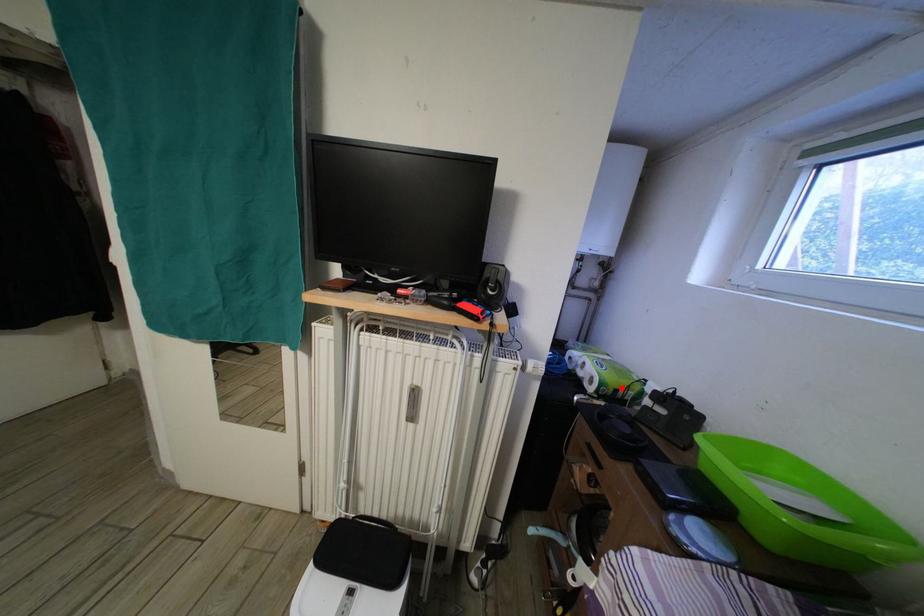
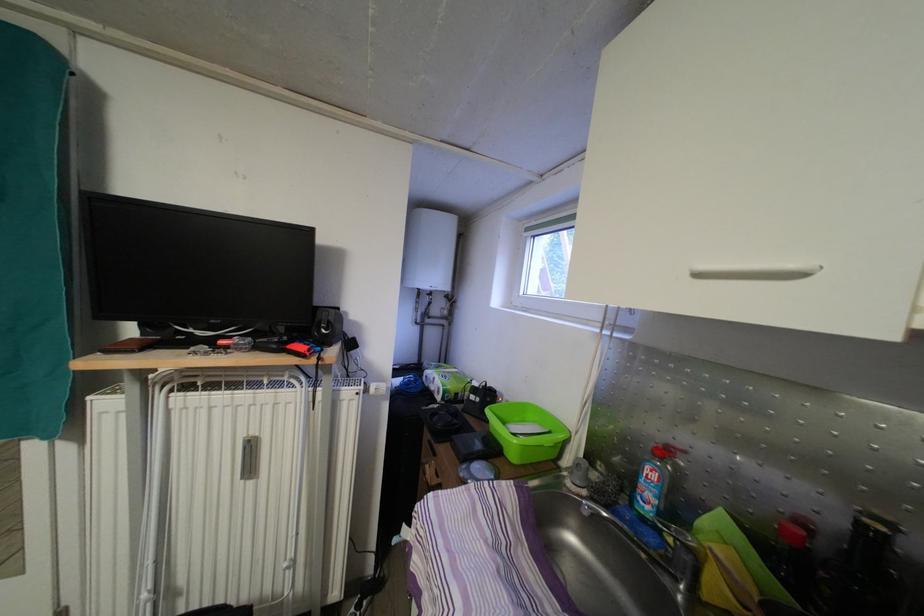
Find the pixel in the second image that matches the highlighted location in the first image.

(460, 394)